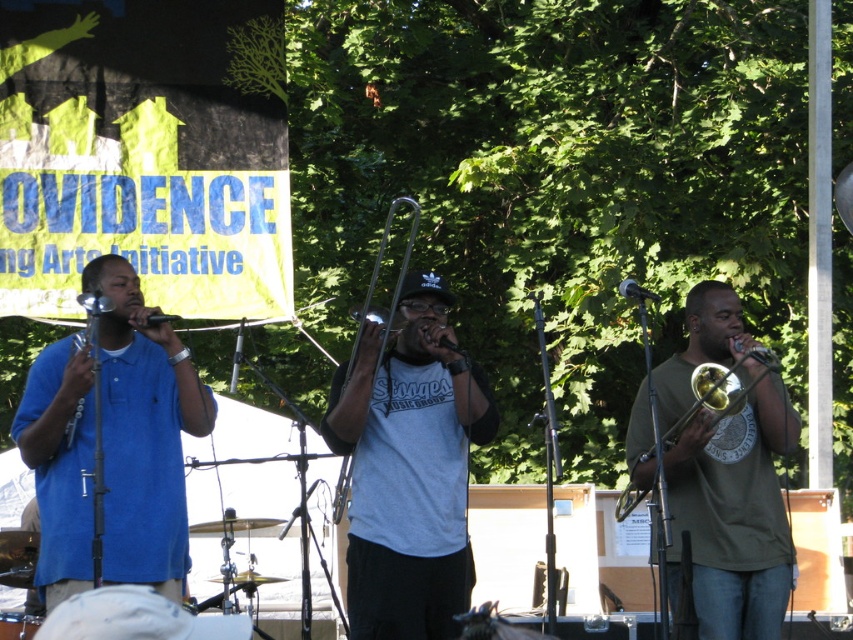
The height and width of the screenshot is (640, 853). Find the location of `gray cotton t-shirt at center`. gray cotton t-shirt at center is located at coordinates (409, 468).

Does point (355, 420) lie behind point (730, 285)?

No, it is in front of (730, 285).

The image size is (853, 640). What are the coordinates of `gray cotton t-shirt at center` in the screenshot? It's located at (409, 468).

Does point (373, 579) come farther from viewer compared to point (711, 371)?

No, it is in front of (711, 371).

Is gray cotton t-shirt at center to the left of gold brass trumpet at center from the viewer's perspective?

Yes, gray cotton t-shirt at center is to the left of gold brass trumpet at center.

Which is behind, point (376, 579) or point (735, 394)?

The point (376, 579) is more distant.

You are a GUI agent. You are given a task and a screenshot of the screen. Output one action in this format:
    pyautogui.click(x=<x>, y=<y>)
    Task: Click on the gray cotton t-shirt at center
    The image size is (853, 640).
    Given the screenshot: What is the action you would take?
    pyautogui.click(x=409, y=468)

Is green matte shirt at center wider than gold brass trumpet at center?

Yes.

Is green matte shirt at center above gold brass trumpet at center?

Actually, green matte shirt at center is below gold brass trumpet at center.

The image size is (853, 640). What do you see at coordinates (734, 512) in the screenshot? I see `green matte shirt at center` at bounding box center [734, 512].

Where is `green matte shirt at center`? Image resolution: width=853 pixels, height=640 pixels. green matte shirt at center is located at coordinates (734, 512).